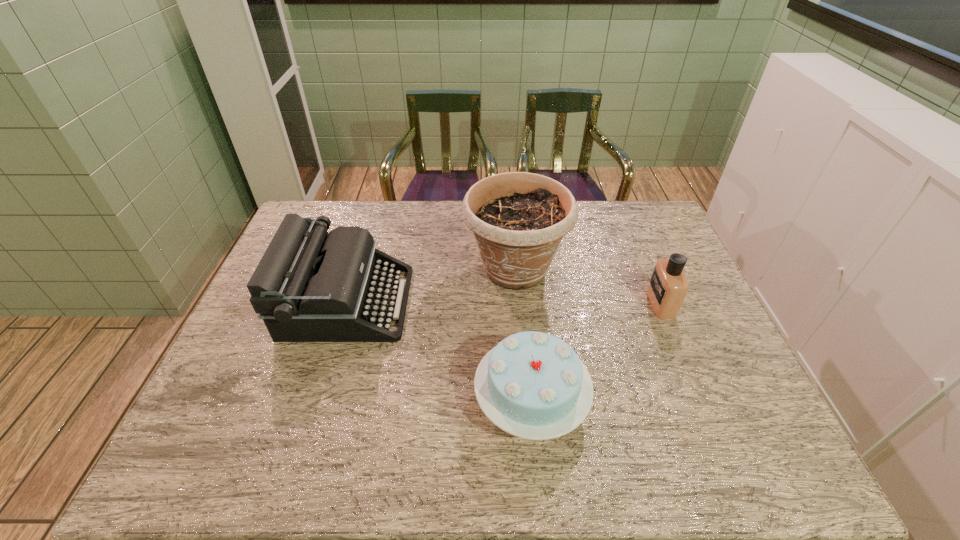
This screenshot has height=540, width=960. Find the location of `empty space that is in between the flowerpot and the leftmost object`. empty space that is in between the flowerpot and the leftmost object is located at coordinates (431, 286).

I want to click on unoccupied position between the typewriter and the birthday cake, so click(440, 351).

The image size is (960, 540). I want to click on vacant point located between the tallest object and the rightmost object, so click(588, 287).

Where is `blank region between the leftmost object and the rightmost object`? blank region between the leftmost object and the rightmost object is located at coordinates (504, 303).

Identify the location of empty location between the perfume and the birthday cake. (596, 352).

This screenshot has width=960, height=540. What are the coordinates of `vacant space in between the flowerpot and the third shortest object` in the screenshot? It's located at [x=431, y=286].

Where is `free point between the birthday cake and the perfume`? This screenshot has height=540, width=960. free point between the birthday cake and the perfume is located at coordinates (596, 352).

Identify which object is located as the nearest to the flowerpot. Please provide its 2D coordinates. Your answer should be formatted as a tuple, i.e. [(x, y)], where the tuple contains the x and y coordinates of a point satisfying the conditions above.

[(310, 286)]

Find the location of a particular element. The image size is (960, 540). the second closest object to the leftmost object is located at coordinates (533, 385).

Locate an element on the screen. Image resolution: width=960 pixels, height=540 pixels. free spot that satisfies the following two spatial constraints: 1. on the back side of the birthday cake; 2. on the typing side of the typewriter is located at coordinates (x=521, y=302).